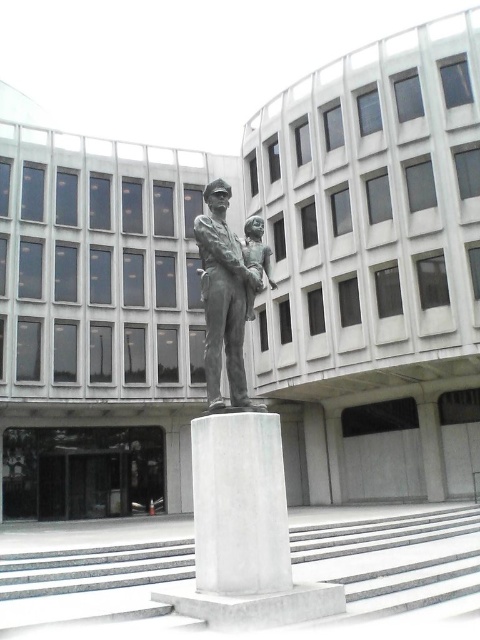
You are an architect designing a pathway between the white marble pillar at center and the bronze statue at center. Which object should you consider for the pathway width due to its greater width?

The white marble pillar at center is wider than the bronze statue at center, so the pathway should be designed around the white marble pillar at center to accommodate its width.

You are an architect designing a new plaza and want to place a new bench between the white marble pillar at center and the bronze statue at center. Since the bench must be placed closer to the taller object, which object should the bench be positioned near?

The white marble pillar at center is taller than the bronze statue at center, so the bench should be placed closer to the white marble pillar at center.